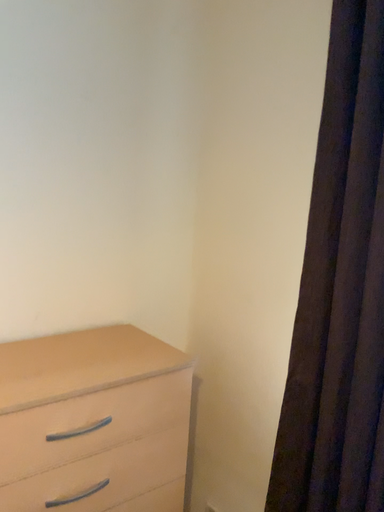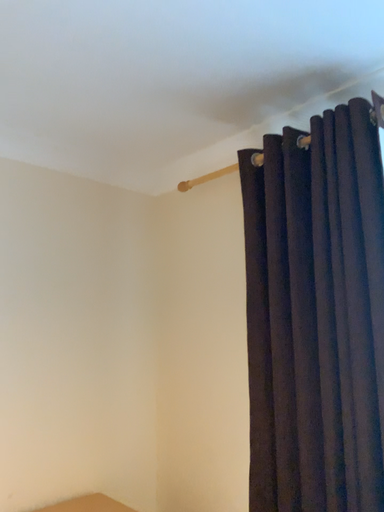
Question: How did the camera likely rotate when shooting the video?

Choices:
 (A) rotated downward
 (B) rotated upward

Answer: (B)